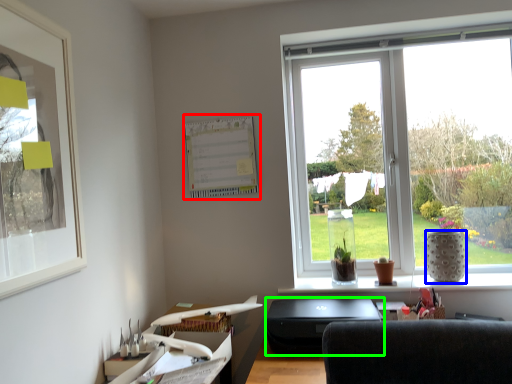
Question: Estimate the real-world distances between objects in this image. Which object is closer to bulletin board (highlighted by a red box), vase (highlighted by a blue box) or desktop (highlighted by a green box)?

Choices:
 (A) vase
 (B) desktop

Answer: (B)